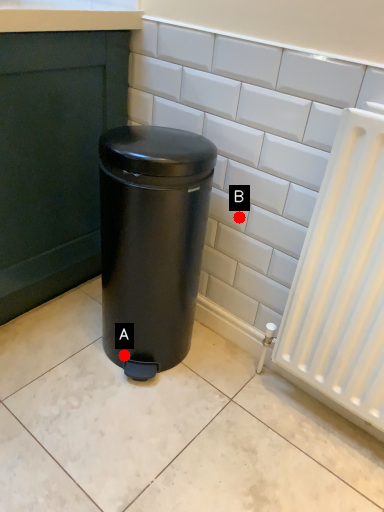
Question: Two points are circled on the image, labeled by A and B beside each circle. Which point appears closest to the camera in this image?

Choices:
 (A) A is closer
 (B) B is closer

Answer: (B)